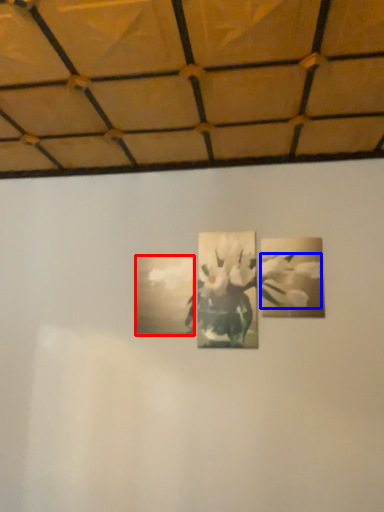
Question: Which of the following is the closest to the observer, picture frame (highlighted by a red box) or flower (highlighted by a blue box)?

Choices:
 (A) picture frame
 (B) flower

Answer: (B)